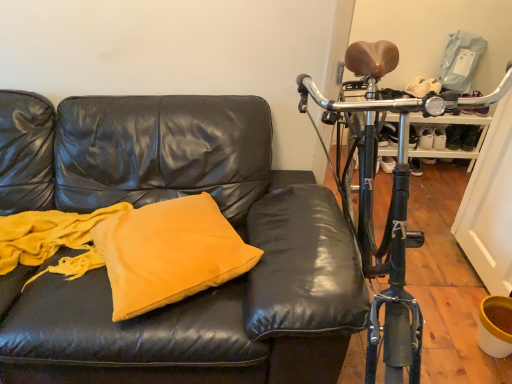
Question: Is matte yellow pillow at center aimed at shiny black bicycle at right?

Choices:
 (A) no
 (B) yes

Answer: (B)

Question: Is matte yellow pillow at center thinner than shiny black bicycle at right?

Choices:
 (A) yes
 (B) no

Answer: (A)

Question: Is matte yellow pillow at center not close to shiny black bicycle at right?

Choices:
 (A) yes
 (B) no

Answer: (B)

Question: Is matte yellow pillow at center positioned with its back to shiny black bicycle at right?

Choices:
 (A) yes
 (B) no

Answer: (B)

Question: Is matte yellow pillow at center to the left of shiny black bicycle at right from the viewer's perspective?

Choices:
 (A) yes
 (B) no

Answer: (A)

Question: Is matte yellow pillow at center shorter than shiny black bicycle at right?

Choices:
 (A) no
 (B) yes

Answer: (B)

Question: Does shiny black bicycle at right have a smaller size compared to matte yellow pillow at center?

Choices:
 (A) yes
 (B) no

Answer: (B)

Question: Does shiny black bicycle at right have a lesser width compared to matte yellow pillow at center?

Choices:
 (A) no
 (B) yes

Answer: (A)

Question: Does shiny black bicycle at right turn towards matte yellow pillow at center?

Choices:
 (A) yes
 (B) no

Answer: (B)

Question: From the image's perspective, does shiny black bicycle at right appear higher than matte yellow pillow at center?

Choices:
 (A) no
 (B) yes

Answer: (B)

Question: Is shiny black bicycle at right turned away from matte yellow pillow at center?

Choices:
 (A) yes
 (B) no

Answer: (B)

Question: Is shiny black bicycle at right in contact with matte yellow pillow at center?

Choices:
 (A) no
 (B) yes

Answer: (A)

Question: Considering the relative positions of shiny black bicycle at right and matte yellow pillow at center in the image provided, is shiny black bicycle at right to the left or to the right of matte yellow pillow at center?

Choices:
 (A) left
 (B) right

Answer: (B)